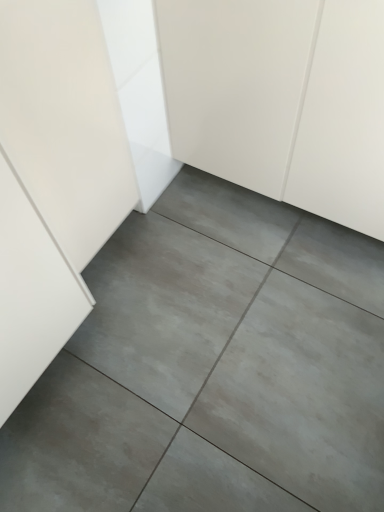
Question: Is point (274, 152) closer or farther from the camera than point (99, 418)?

Choices:
 (A) farther
 (B) closer

Answer: (A)

Question: Based on their positions, is white matte cabinet at center located to the left or right of gray concrete floor at center?

Choices:
 (A) right
 (B) left

Answer: (A)

Question: From the image's perspective, is white matte cabinet at center above or below gray concrete floor at center?

Choices:
 (A) above
 (B) below

Answer: (A)

Question: From a real-world perspective, is gray concrete floor at center positioned above or below white matte cabinet at center?

Choices:
 (A) below
 (B) above

Answer: (A)

Question: From the image's perspective, is gray concrete floor at center positioned above or below white matte cabinet at center?

Choices:
 (A) below
 (B) above

Answer: (A)

Question: Considering the positions of gray concrete floor at center and white matte cabinet at center in the image, is gray concrete floor at center taller or shorter than white matte cabinet at center?

Choices:
 (A) short
 (B) tall

Answer: (A)

Question: In the image, is gray concrete floor at center on the left side or the right side of white matte cabinet at center?

Choices:
 (A) left
 (B) right

Answer: (A)